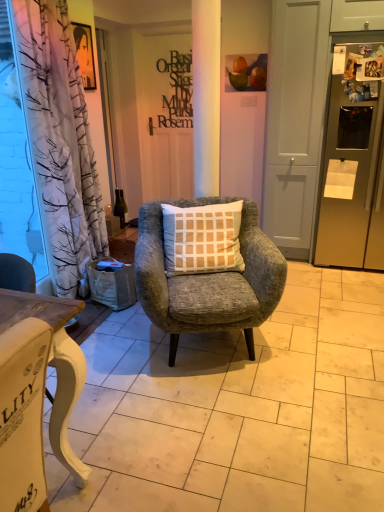
Question: From their relative heights in the image, would you say white matte screen door at center is taller or shorter than white painted wood desk at lower left?

Choices:
 (A) short
 (B) tall

Answer: (B)

Question: From the image's perspective, is white matte screen door at center above or below white painted wood desk at lower left?

Choices:
 (A) below
 (B) above

Answer: (B)

Question: Estimate the real-world distances between objects in this image. Which object is farther from the matte black sign at center?

Choices:
 (A) white matte screen door at center
 (B) transparent plastic curtain at left
 (C) green glass bottle at center
 (D) textured gray armchair at center
 (E) satin gold refrigerator at right

Answer: (D)

Question: Which of these objects is positioned closest to the transparent plastic curtain at left?

Choices:
 (A) satin gold refrigerator at right
 (B) textured gray armchair at center
 (C) matte black sign at center
 (D) green glass bottle at center
 (E) white matte screen door at center

Answer: (D)